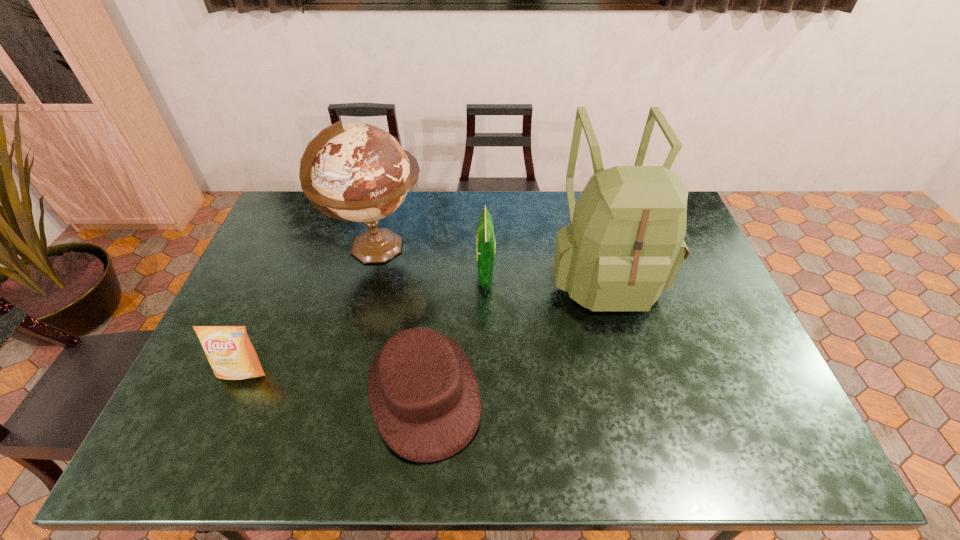
What are the coordinates of `globe` in the screenshot? It's located at (360, 173).

Where is `the rightmost object`? Image resolution: width=960 pixels, height=540 pixels. the rightmost object is located at coordinates (625, 245).

I want to click on the right crisp (potato chip), so click(485, 241).

You are a GUI agent. You are given a task and a screenshot of the screen. Output one action in this format:
    pyautogui.click(x=<x>, y=<y>)
    Task: Click on the taller crisp (potato chip)
    Image resolution: width=960 pixels, height=540 pixels.
    Given the screenshot: What is the action you would take?
    pyautogui.click(x=485, y=241)

This screenshot has height=540, width=960. What are the coordinates of `the left crisp (potato chip)` in the screenshot? It's located at (228, 349).

Where is `the nearer crisp (potato chip)`? the nearer crisp (potato chip) is located at coordinates (228, 349).

Image resolution: width=960 pixels, height=540 pixels. In order to click on hat in this screenshot , I will do `click(424, 397)`.

Identify the location of free space located 0.100m on the front of the globe showing Asia. (457, 248).

Find the location of `vacant area situated 0.380m on the front pocket of the backpack`. vacant area situated 0.380m on the front pocket of the backpack is located at coordinates (654, 459).

Where is `vacant space located 0.120m on the front-facing side of the farther crisp (potato chip)`? vacant space located 0.120m on the front-facing side of the farther crisp (potato chip) is located at coordinates (438, 275).